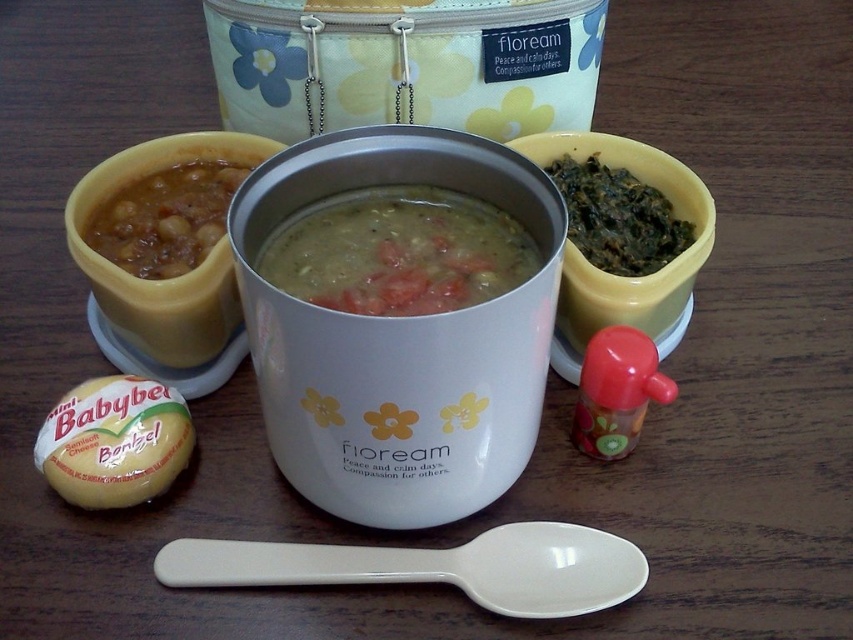
From the picture: Does green matte soup at center have a lesser width compared to white plastic spoon at lower center?

Yes.

Can you confirm if green matte soup at center is shorter than white plastic spoon at lower center?

In fact, green matte soup at center may be taller than white plastic spoon at lower center.

This screenshot has width=853, height=640. Find the location of `green matte soup at center`. green matte soup at center is located at coordinates (398, 252).

Who is lower down, green matte soup at center or green leafy vegetable at upper right?

Positioned lower is green matte soup at center.

Who is positioned more to the left, green matte soup at center or green leafy vegetable at upper right?

From the viewer's perspective, green matte soup at center appears more on the left side.

What do you see at coordinates (398, 252) in the screenshot? The width and height of the screenshot is (853, 640). I see `green matte soup at center` at bounding box center [398, 252].

Image resolution: width=853 pixels, height=640 pixels. I want to click on green matte soup at center, so click(398, 252).

Between white plastic spoon at lower center and brown matte beans at left, which one has more height?

brown matte beans at left

Can you confirm if white plastic spoon at lower center is thinner than brown matte beans at left?

No.

Consider the image. Who is more distant from viewer, (587, 540) or (125, 269)?

The point (125, 269) is more distant.

Identify the location of white plastic spoon at lower center. The height and width of the screenshot is (640, 853). (434, 566).